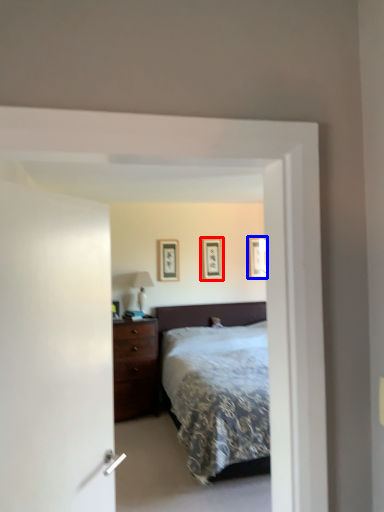
Question: Among these objects, which one is farthest to the camera, picture frame (highlighted by a red box) or picture frame (highlighted by a blue box)?

Choices:
 (A) picture frame
 (B) picture frame

Answer: (B)